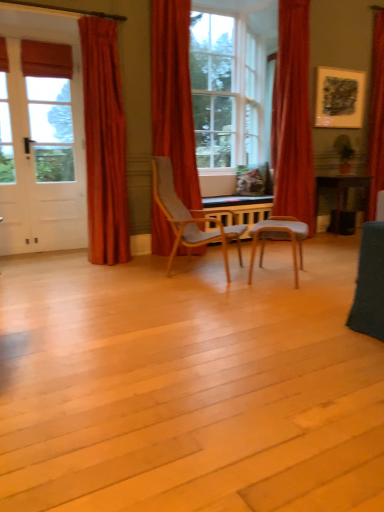
Question: Is matte glass window at center located within green matte houseplant at upper right?

Choices:
 (A) yes
 (B) no

Answer: (B)

Question: Is green matte houseplant at upper right to the left of matte glass window at center from the viewer's perspective?

Choices:
 (A) no
 (B) yes

Answer: (A)

Question: Is green matte houseplant at upper right positioned in front of matte glass window at center?

Choices:
 (A) no
 (B) yes

Answer: (A)

Question: Does green matte houseplant at upper right have a smaller size compared to matte glass window at center?

Choices:
 (A) yes
 (B) no

Answer: (A)

Question: From a real-world perspective, is green matte houseplant at upper right physically above matte glass window at center?

Choices:
 (A) no
 (B) yes

Answer: (A)

Question: Based on their sizes in the image, would you say velvet red curtain at right, the second curtain positioned from the right, is bigger or smaller than matte black picture frame at upper right?

Choices:
 (A) small
 (B) big

Answer: (B)

Question: Considering their positions, is velvet red curtain at right, the 3th curtain viewed from the left, located in front of or behind matte black picture frame at upper right?

Choices:
 (A) behind
 (B) front

Answer: (B)

Question: Would you say velvet red curtain at right, the 3th curtain viewed from the left, is inside or outside matte black picture frame at upper right?

Choices:
 (A) outside
 (B) inside

Answer: (A)

Question: From a real-world perspective, is velvet red curtain at right, the second curtain positioned from the right, positioned above or below matte black picture frame at upper right?

Choices:
 (A) above
 (B) below

Answer: (B)

Question: In terms of width, does matte black picture frame at upper right look wider or thinner when compared to red velvet curtain at right, which is counted as the 4th curtain, starting from the left?

Choices:
 (A) wide
 (B) thin

Answer: (B)

Question: Which is correct: matte black picture frame at upper right is inside red velvet curtain at right, the first curtain in the right-to-left sequence, or outside of it?

Choices:
 (A) inside
 (B) outside

Answer: (B)

Question: Is point (359, 113) positioned closer to the camera than point (382, 162)?

Choices:
 (A) closer
 (B) farther

Answer: (B)

Question: Relative to red velvet curtain at right, the first curtain in the right-to-left sequence, is matte black picture frame at upper right in front or behind?

Choices:
 (A) front
 (B) behind

Answer: (B)

Question: In terms of height, does velvet red curtain at right, the 3th curtain viewed from the left, look taller or shorter compared to velvet red curtain at center, placed as the 2th curtain when sorted from left to right?

Choices:
 (A) tall
 (B) short

Answer: (A)

Question: Looking at the image, does velvet red curtain at right, the 3th curtain viewed from the left, seem bigger or smaller compared to velvet red curtain at center, placed as the 2th curtain when sorted from left to right?

Choices:
 (A) small
 (B) big

Answer: (B)